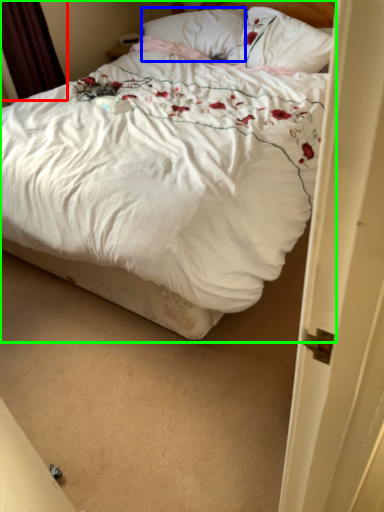
Question: Based on their relative distances, which object is nearer to curtain (highlighted by a red box)? Choose from pillow (highlighted by a blue box) and bed (highlighted by a green box).

Choices:
 (A) pillow
 (B) bed

Answer: (A)